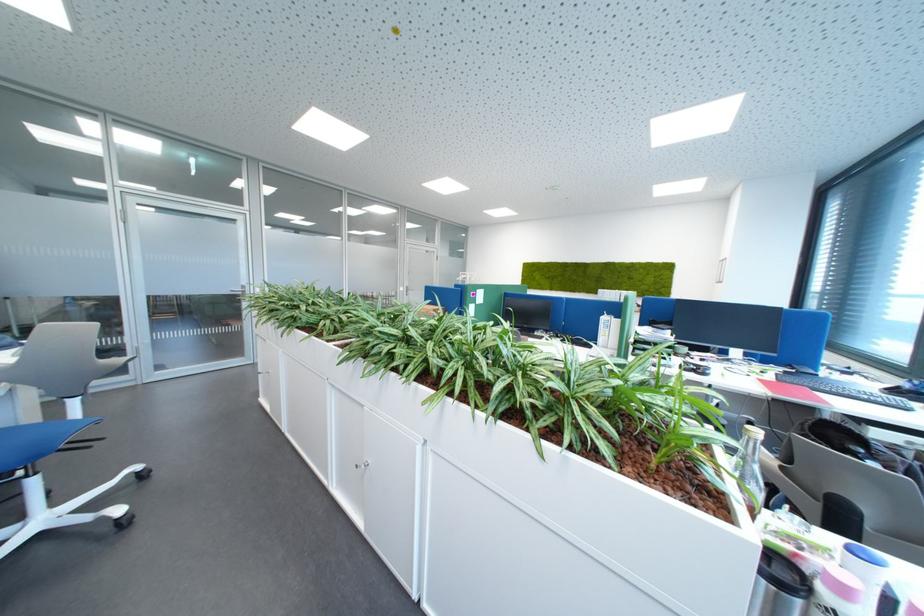
What do you see at coordinates (55, 427) in the screenshot? I see `the blue chair sitting surface` at bounding box center [55, 427].